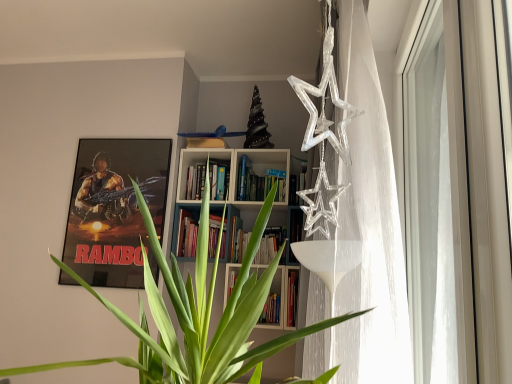
The image size is (512, 384). What do you see at coordinates (114, 208) in the screenshot?
I see `metallic poster at upper left` at bounding box center [114, 208].

Image resolution: width=512 pixels, height=384 pixels. In order to click on metallic poster at upper left in this screenshot , I will do `click(114, 208)`.

What do you see at coordinates (438, 196) in the screenshot? I see `transparent glass window at right` at bounding box center [438, 196].

Identify the location of transparent glass window at right. Image resolution: width=512 pixels, height=384 pixels. (438, 196).

Image resolution: width=512 pixels, height=384 pixels. In order to click on metallic poster at upper left in this screenshot , I will do `click(114, 208)`.

Is metallic poster at upper left to the left of transparent glass window at right from the viewer's perspective?

Indeed, metallic poster at upper left is positioned on the left side of transparent glass window at right.

Relative to transparent glass window at right, is metallic poster at upper left in front or behind?

Clearly, metallic poster at upper left is behind transparent glass window at right.

Is point (73, 189) positioned before point (444, 226)?

No.

From the image's perspective, is metallic poster at upper left on transparent glass window at right?

No, from the image's perspective, metallic poster at upper left is not over transparent glass window at right.

From a real-world perspective, is metallic poster at upper left above or below transparent glass window at right?

From a real-world perspective, metallic poster at upper left is physically above transparent glass window at right.

Is metallic poster at upper left wider than transparent glass window at right?

Correct, the width of metallic poster at upper left exceeds that of transparent glass window at right.

From their relative heights in the image, would you say metallic poster at upper left is taller or shorter than transparent glass window at right?

In the image, metallic poster at upper left appears to be shorter than transparent glass window at right.

Between metallic poster at upper left and transparent glass window at right, which one has larger size?

With larger size is transparent glass window at right.

Is metallic poster at upper left located outside transparent glass window at right?

metallic poster at upper left is positioned outside transparent glass window at right.

Is metallic poster at upper left directly adjacent to transparent glass window at right?

No, metallic poster at upper left is not with transparent glass window at right.

Is metallic poster at upper left facing away from transparent glass window at right?

That's not correct — metallic poster at upper left is not looking away from transparent glass window at right.

Where is `picture frame on the left of transparent glass window at right`? This screenshot has width=512, height=384. picture frame on the left of transparent glass window at right is located at coordinates (114, 208).

Can you confirm if transparent glass window at right is positioned to the left of metallic poster at upper left?

No.

In the image, is transparent glass window at right positioned in front of or behind metallic poster at upper left?

transparent glass window at right is positioned closer to the viewer than metallic poster at upper left.

Is point (408, 152) closer to viewer compared to point (121, 180)?

Yes.

From the image's perspective, does transparent glass window at right appear higher than metallic poster at upper left?

Yes, from the image's perspective, transparent glass window at right is over metallic poster at upper left.

From a real-world perspective, is transparent glass window at right physically above metallic poster at upper left?

No, from a real-world perspective, transparent glass window at right is not on top of metallic poster at upper left.

Considering the sizes of transparent glass window at right and metallic poster at upper left in the image, is transparent glass window at right wider or thinner than metallic poster at upper left?

Clearly, transparent glass window at right has less width compared to metallic poster at upper left.

Who is taller, transparent glass window at right or metallic poster at upper left?

Standing taller between the two is transparent glass window at right.

Considering the sizes of objects transparent glass window at right and metallic poster at upper left in the image provided, who is smaller, transparent glass window at right or metallic poster at upper left?

metallic poster at upper left is smaller.

Is metallic poster at upper left inside transparent glass window at right?

No, metallic poster at upper left is not a part of transparent glass window at right.

Does transparent glass window at right touch metallic poster at upper left?

transparent glass window at right and metallic poster at upper left are not in contact.

Is transparent glass window at right facing away from metallic poster at upper left?

No, transparent glass window at right is not facing away from metallic poster at upper left.

The width and height of the screenshot is (512, 384). In order to click on window in front of the metallic poster at upper left in this screenshot , I will do `click(438, 196)`.

Where is `window directly beneath the metallic poster at upper left (from a real-world perspective)`? This screenshot has width=512, height=384. window directly beneath the metallic poster at upper left (from a real-world perspective) is located at coordinates (438, 196).

Identify the location of window lying in front of the metallic poster at upper left. The image size is (512, 384). (438, 196).